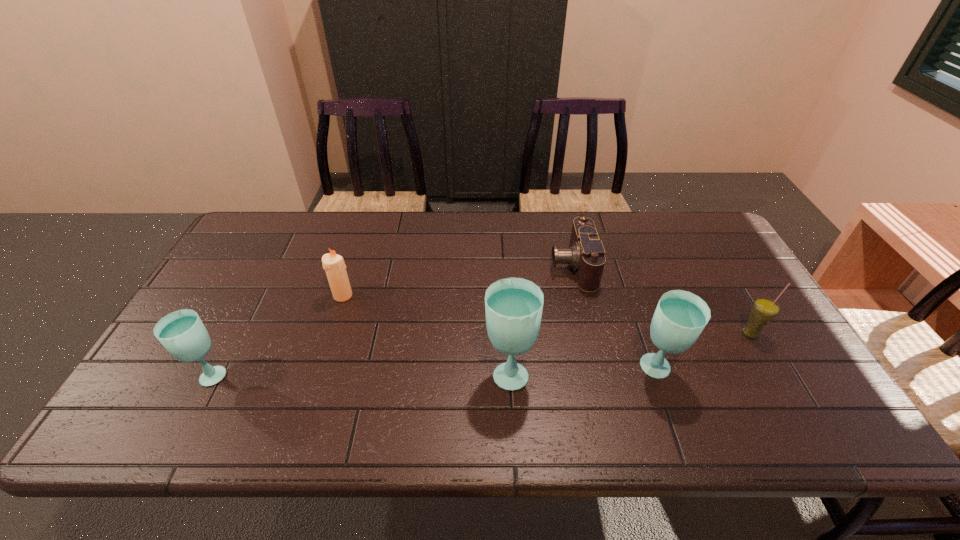
The image size is (960, 540). Find the location of `vacant area situated on the back of the leftmost glass`. vacant area situated on the back of the leftmost glass is located at coordinates (272, 258).

Identify the location of free space located on the right of the fourth object from right to left. The height and width of the screenshot is (540, 960). (579, 372).

Locate an element on the screen. This screenshot has height=540, width=960. free point located 0.090m on the left of the fifth shortest object is located at coordinates (599, 370).

Where is `vacant space situated 0.050m on the back of the rightmost object`? The width and height of the screenshot is (960, 540). vacant space situated 0.050m on the back of the rightmost object is located at coordinates (737, 312).

At what (x,y) coordinates should I click in order to perform the action: click on free space located 0.050m on the front-facing side of the fourth object from left to right. Please return your answer as a coordinate pair (x, y). The width and height of the screenshot is (960, 540). Looking at the image, I should click on (534, 265).

The width and height of the screenshot is (960, 540). I want to click on free region located on the front-facing side of the fourth object from left to right, so click(x=489, y=265).

Locate an element on the screen. free spot located on the front-facing side of the fourth object from left to right is located at coordinates (498, 265).

Locate an element on the screen. The image size is (960, 540). vacant region located 0.110m on the front of the fifth object from right to left is located at coordinates (331, 333).

This screenshot has height=540, width=960. I want to click on object that is at the far edge, so click(x=586, y=254).

Identify the location of object present at the left edge. (182, 333).